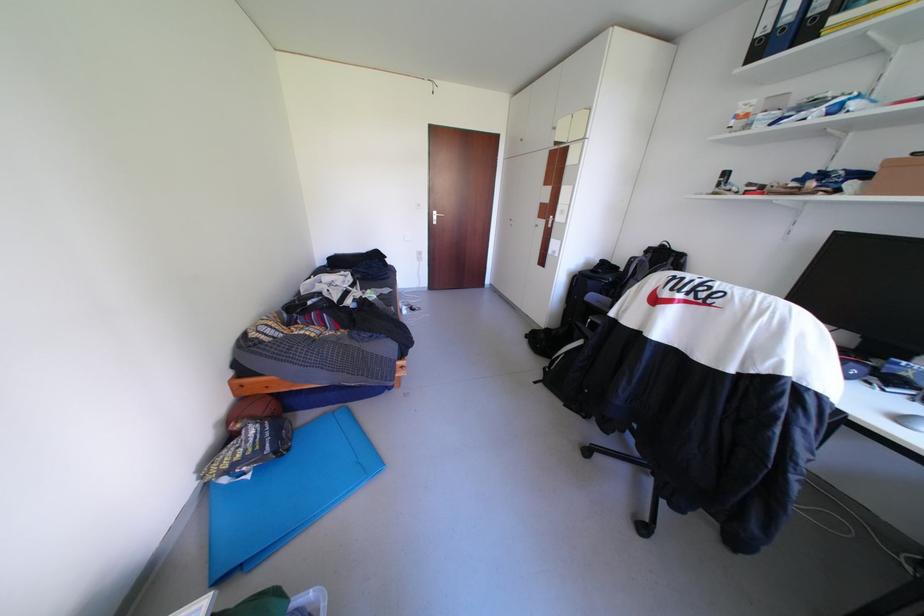
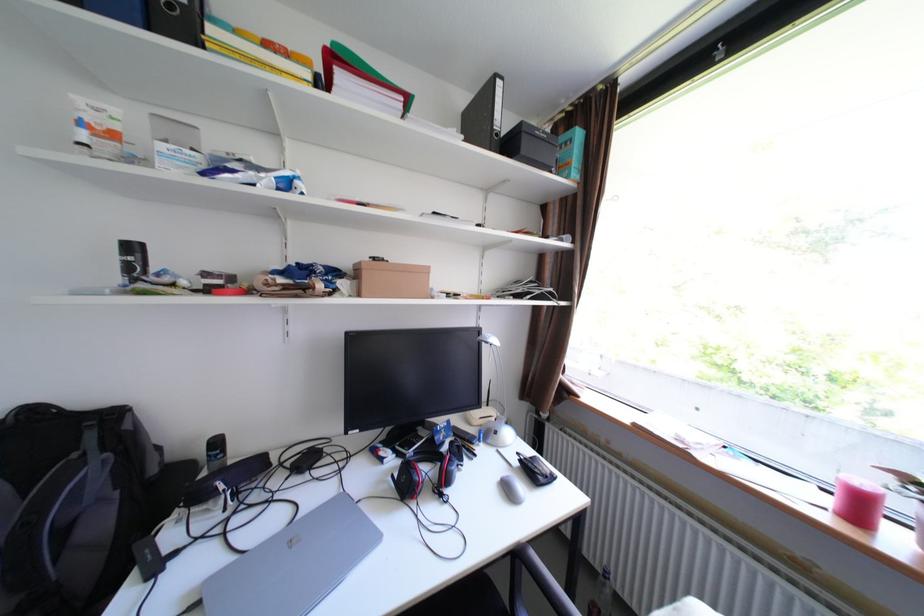
Locate, in the second image, the point that corresponds to pixel 736 175 in the first image.

(143, 248)